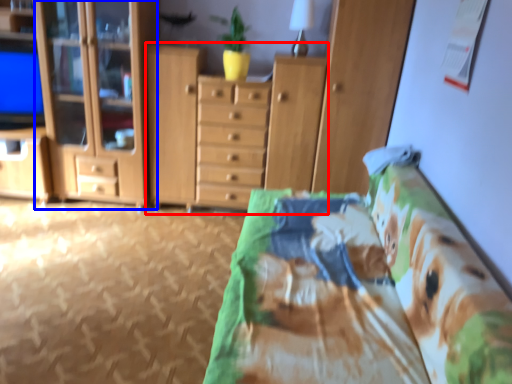
Question: Among these objects, which one is nearest to the camera, cupboard (highlighted by a red box) or cabinetry (highlighted by a blue box)?

Choices:
 (A) cupboard
 (B) cabinetry

Answer: (B)